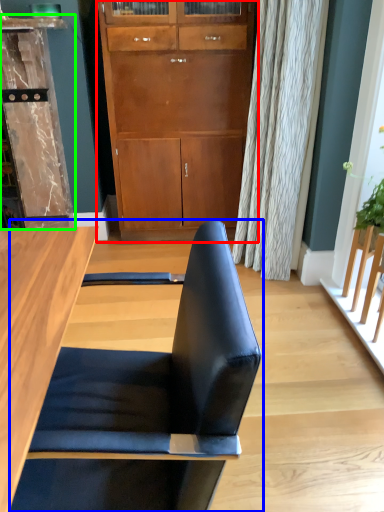
Question: Based on their relative distances, which object is nearer to cabinetry (highlighted by a red box)? Choose from chair (highlighted by a blue box) and dresser (highlighted by a green box).

Choices:
 (A) chair
 (B) dresser

Answer: (B)